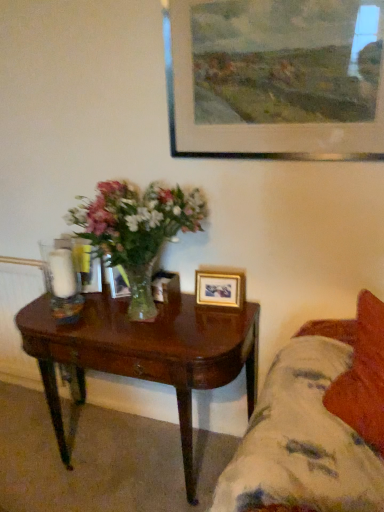
Locate an element on the screen. The image size is (384, 512). free space in front of gold metallic picture frame at lower right, positioned as the second picture frame in back-to-front order is located at coordinates (216, 332).